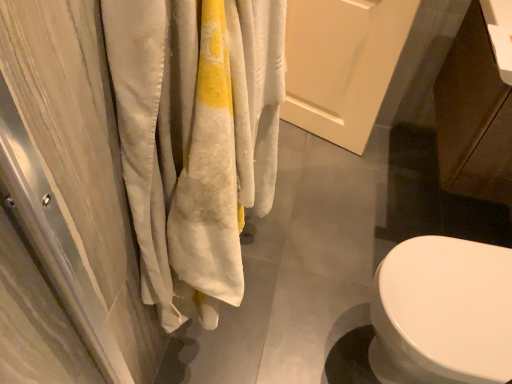
The width and height of the screenshot is (512, 384). In order to click on brown matte cabinet at lower right in this screenshot , I will do `click(477, 105)`.

The height and width of the screenshot is (384, 512). Describe the element at coordinates (477, 105) in the screenshot. I see `brown matte cabinet at lower right` at that location.

This screenshot has width=512, height=384. Describe the element at coordinates (342, 64) in the screenshot. I see `white matte door at center` at that location.

Find the location of `white matte door at center`. white matte door at center is located at coordinates (342, 64).

Where is `brown matte cabinet at lower right`? brown matte cabinet at lower right is located at coordinates (477, 105).

Does white matte door at center appear on the right side of brown matte cabinet at lower right?

Incorrect, white matte door at center is not on the right side of brown matte cabinet at lower right.

Which object is further away from the camera taking this photo, white matte door at center or brown matte cabinet at lower right?

white matte door at center.

Is point (322, 126) behind point (453, 192)?

Yes.

From the image's perspective, is white matte door at center over brown matte cabinet at lower right?

Indeed, from the image's perspective, white matte door at center is shown above brown matte cabinet at lower right.

From a real-world perspective, does white matte door at center sit lower than brown matte cabinet at lower right?

Indeed, from a real-world perspective, white matte door at center is positioned beneath brown matte cabinet at lower right.

Does white matte door at center have a lesser width compared to brown matte cabinet at lower right?

Yes.

Between white matte door at center and brown matte cabinet at lower right, which one has more height?

With more height is white matte door at center.

Considering the sizes of white matte door at center and brown matte cabinet at lower right in the image, is white matte door at center bigger or smaller than brown matte cabinet at lower right?

In the image, white matte door at center appears to be smaller than brown matte cabinet at lower right.

Is white matte door at center completely or partially outside of brown matte cabinet at lower right?

Absolutely, white matte door at center is external to brown matte cabinet at lower right.

Is white matte door at center not close to brown matte cabinet at lower right?

No, white matte door at center is not far away from brown matte cabinet at lower right.

Is white matte door at center facing towards brown matte cabinet at lower right?

No, white matte door at center is not facing towards brown matte cabinet at lower right.

How different are the orientations of white matte door at center and brown matte cabinet at lower right in degrees?

They differ by 80.1 degrees in their facing directions.

How far apart are white matte door at center and brown matte cabinet at lower right?

16.51 inches.

Locate an element on the screen. The height and width of the screenshot is (384, 512). cabinetry in front of the white matte door at center is located at coordinates [x=477, y=105].

Between brown matte cabinet at lower right and white matte door at center, which one appears on the right side from the viewer's perspective?

Positioned to the right is brown matte cabinet at lower right.

Is brown matte cabinet at lower right closer to the viewer compared to white matte door at center?

That is True.

Does point (443, 87) come behind point (355, 50)?

No, (443, 87) is in front of (355, 50).

From the image's perspective, is brown matte cabinet at lower right over white matte door at center?

No, from the image's perspective, brown matte cabinet at lower right is not on top of white matte door at center.

From a real-world perspective, between brown matte cabinet at lower right and white matte door at center, who is vertically higher?

From a 3D spatial view, brown matte cabinet at lower right is above.

Considering the sizes of brown matte cabinet at lower right and white matte door at center in the image, is brown matte cabinet at lower right wider or thinner than white matte door at center?

brown matte cabinet at lower right is wider than white matte door at center.

Considering the sizes of objects brown matte cabinet at lower right and white matte door at center in the image provided, who is shorter, brown matte cabinet at lower right or white matte door at center?

brown matte cabinet at lower right is shorter.

Does brown matte cabinet at lower right have a larger size compared to white matte door at center?

Correct, brown matte cabinet at lower right is larger in size than white matte door at center.

Is brown matte cabinet at lower right inside or outside of white matte door at center?

brown matte cabinet at lower right is spatially situated outside white matte door at center.

Is the surface of brown matte cabinet at lower right in direct contact with white matte door at center?

There is a gap between brown matte cabinet at lower right and white matte door at center.

Looking at this image, is brown matte cabinet at lower right facing away from white matte door at center?

No, brown matte cabinet at lower right is not facing the opposite direction of white matte door at center.

Can you tell me how much brown matte cabinet at lower right and white matte door at center differ in facing direction?

The facing directions of brown matte cabinet at lower right and white matte door at center are 80.1 degrees apart.

Find the location of a particular element. The height and width of the screenshot is (384, 512). cabinetry below the white matte door at center (from the image's perspective) is located at coordinates (477, 105).

This screenshot has height=384, width=512. I want to click on screen door that appears above the brown matte cabinet at lower right (from the image's perspective), so [342, 64].

Find the location of a particular element. The image size is (512, 384). cabinetry that appears in front of the white matte door at center is located at coordinates point(477,105).